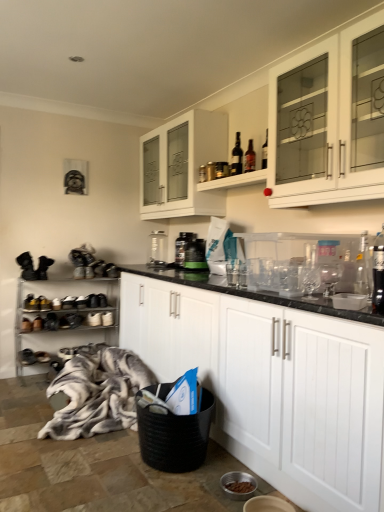
The height and width of the screenshot is (512, 384). What do you see at coordinates (62, 318) in the screenshot?
I see `metallic silver shoe rack at left, placed as the 1th shelf when sorted from left to right` at bounding box center [62, 318].

The image size is (384, 512). What do you see at coordinates (27, 357) in the screenshot?
I see `black suede shoe at lower left` at bounding box center [27, 357].

Measure the distance between black suede shoe at lower left and camera.

A distance of 3.54 meters exists between black suede shoe at lower left and camera.

In order to click on white glass cabinet at upper center, which ranks as the 1th cabinetry in top-to-bottom order in this screenshot , I will do `click(184, 164)`.

In order to face white matte cabinet at center, marked as the third cabinetry in a top-to-bottom arrangement, should I rotate leftwards or rightwards?

You should rotate right by 5.157 degrees.

What are the coordinates of `matte glass bottles at upper center, positioned as the 2th shelf in bottom-to-top order` in the screenshot? It's located at pos(234,181).

Locate an element on the screen. The height and width of the screenshot is (512, 384). dark glass bottle at upper center, the first bottle in the back-to-front sequence is located at coordinates (236, 157).

Where is `metallic silver shoe rack at left, which is the first shelf from bottom to top`? metallic silver shoe rack at left, which is the first shelf from bottom to top is located at coordinates (62, 318).

Looking at this image, from a real-world perspective, which object rests below the other?

From a 3D spatial view, white fur blanket at left is below.

Are matte glass bottles at upper center, positioned as the second shelf in left-to-right order, and white fur blanket at left beside each other?

No, matte glass bottles at upper center, positioned as the second shelf in left-to-right order, is not with white fur blanket at left.

How different are the orientations of matte glass bottles at upper center, marked as the 1th shelf in a front-to-back arrangement, and white fur blanket at left in degrees?

matte glass bottles at upper center, marked as the 1th shelf in a front-to-back arrangement, and white fur blanket at left are facing 0.0913 degrees away from each other.

Is white fur blanket at left surrounded by matte glass bottles at upper center, the first shelf in the top-to-bottom sequence?

That's incorrect, white fur blanket at left is not inside matte glass bottles at upper center, the first shelf in the top-to-bottom sequence.

Image resolution: width=384 pixels, height=512 pixels. There is a white fur blanket at left. Identify the location of the 2nd shelf above it (from a real-world perspective). (234, 181).

In the scene shown: Is white fur blanket at left closer to camera compared to matte glass bottles at upper center, positioned as the 2th shelf in bottom-to-top order?

Yes, white fur blanket at left is closer to the camera.

Does point (47, 426) appear closer or farther from the camera than point (212, 185)?

Clearly, point (47, 426) is closer to the camera than point (212, 185).

Is white fur blanket at left situated inside matte glass bottles at upper center, the first shelf in the top-to-bottom sequence, or outside?

white fur blanket at left is not enclosed by matte glass bottles at upper center, the first shelf in the top-to-bottom sequence.

Does point (181, 260) come closer to viewer compared to point (185, 257)?

No, (181, 260) is behind (185, 257).

Does black plastic bottle at center lie behind black plastic container at center?

Yes, black plastic bottle at center is further from the camera.

This screenshot has height=512, width=384. Identify the location of beverage to the left of black plastic container at center. (183, 246).

From the picture: Is white fur blanket at left inside white matte cabinet at center, marked as the third cabinetry in a top-to-bottom arrangement?

Definitely not — white fur blanket at left is not inside white matte cabinet at center, marked as the third cabinetry in a top-to-bottom arrangement.

Considering the relative sizes of white matte cabinet at center, acting as the first cabinetry starting from the bottom, and white fur blanket at left in the image provided, is white matte cabinet at center, acting as the first cabinetry starting from the bottom, wider than white fur blanket at left?

In fact, white matte cabinet at center, acting as the first cabinetry starting from the bottom, might be narrower than white fur blanket at left.

Considering the relative sizes of white matte cabinet at center, marked as the third cabinetry in a top-to-bottom arrangement, and white fur blanket at left in the image provided, is white matte cabinet at center, marked as the third cabinetry in a top-to-bottom arrangement, shorter than white fur blanket at left?

In fact, white matte cabinet at center, marked as the third cabinetry in a top-to-bottom arrangement, may be taller than white fur blanket at left.

From the image's perspective, is white matte cabinet at center, marked as the third cabinetry in a top-to-bottom arrangement, over white fur blanket at left?

Indeed, from the image's perspective, white matte cabinet at center, marked as the third cabinetry in a top-to-bottom arrangement, is shown above white fur blanket at left.

Considering the sizes of objects black woven laundry basket at lower center and white matte cabinet at center, marked as the third cabinetry in a top-to-bottom arrangement, in the image provided, who is smaller, black woven laundry basket at lower center or white matte cabinet at center, marked as the third cabinetry in a top-to-bottom arrangement,?

black woven laundry basket at lower center is smaller.

How different are the orientations of black woven laundry basket at lower center and white matte cabinet at center, marked as the third cabinetry in a top-to-bottom arrangement, in degrees?

black woven laundry basket at lower center and white matte cabinet at center, marked as the third cabinetry in a top-to-bottom arrangement, are facing 14.1 degrees away from each other.

Which is less distant, [167,426] or [141,275]?

Point [167,426] is closer to the camera than point [141,275].

Are white glass cabinet at upper center, acting as the third cabinetry starting from the bottom, and black plastic container at center making contact?

There is a gap between white glass cabinet at upper center, acting as the third cabinetry starting from the bottom, and black plastic container at center.

Is white glass cabinet at upper center, which ranks as the 1th cabinetry in top-to-bottom order, to the left or to the right of black plastic container at center in the image?

white glass cabinet at upper center, which ranks as the 1th cabinetry in top-to-bottom order, is to the left of black plastic container at center.

Is point (178, 139) closer to camera compared to point (199, 244)?

No.

From the image's perspective, would you say white glass cabinet at upper center, acting as the third cabinetry starting from the bottom, is positioned over black plastic container at center?

Yes.

Does point (101, 383) come behind point (242, 156)?

Yes, point (101, 383) is behind point (242, 156).

Which of these two, white fur blanket at left or dark glass bottle at upper center, which is counted as the first bottle, starting from the top, stands taller?

white fur blanket at left.

Image resolution: width=384 pixels, height=512 pixels. Identify the location of the 1st bottle to the right when counting from the white fur blanket at left. (236, 157).

From the image's perspective, which one is positioned lower, white fur blanket at left or dark glass bottle at upper center, the 1th bottle when ordered from left to right?

white fur blanket at left, from the image's perspective.

From the white fur blanket at left, count 1st shelfs backward and point to it. Please provide its 2D coordinates.

[(234, 181)]

From a real-world perspective, starting from the white fur blanket at left, which shelf is the 2nd one vertically above it? Please provide its 2D coordinates.

[(234, 181)]

Looking at the image, which one is located further to white fur blanket at left, black woven laundry basket at lower center or black plastic bottle at center?

black plastic bottle at center.

From the picture: Looking at the image, which one is located further to matte glass bottles at upper center, positioned as the 2th shelf in bottom-to-top order, black woven laundry basket at lower center or black plastic bottle at center?

black woven laundry basket at lower center.

Based on their spatial positions, is white fur blanket at left or black plastic container at center closer to black woven laundry basket at lower center?

The object closer to black woven laundry basket at lower center is white fur blanket at left.

Looking at the image, which one is located closer to white matte cabinet at center, marked as the third cabinetry in a top-to-bottom arrangement, clear glass bottle at upper right, arranged as the 1th bottle when ordered from the bottom, or black suede shoe at lower left?

clear glass bottle at upper right, arranged as the 1th bottle when ordered from the bottom, is positioned closer to the anchor white matte cabinet at center, marked as the third cabinetry in a top-to-bottom arrangement.

Based on their spatial positions, is white glass cabinet at upper center, acting as the third cabinetry starting from the bottom, or white fur blanket at left further from dark glass bottle at upper center, the first bottle in the back-to-front sequence?

white fur blanket at left is further to dark glass bottle at upper center, the first bottle in the back-to-front sequence.

Looking at the image, which one is located further to clear glass bottle at upper right, which ranks as the second bottle in top-to-bottom order, dark glass bottle at upper center, the 2th bottle positioned from the right, or black woven laundry basket at lower center?

Based on the image, black woven laundry basket at lower center appears to be further to clear glass bottle at upper right, which ranks as the second bottle in top-to-bottom order.

Looking at the image, which one is located further to clear glass bottle at upper right, acting as the second bottle starting from the left, white matte cabinet at center, marked as the third cabinetry in a top-to-bottom arrangement, or matte glass bottles at upper center, which ranks as the second shelf in back-to-front order?

Based on the image, matte glass bottles at upper center, which ranks as the second shelf in back-to-front order, appears to be further to clear glass bottle at upper right, acting as the second bottle starting from the left.

Estimate the real-world distances between objects in this image. Which object is closer to clear glass bottle at upper right, the second bottle viewed from the back, white matte cabinet at center, marked as the third cabinetry in a top-to-bottom arrangement, or black plastic bottle at center?

Among the two, white matte cabinet at center, marked as the third cabinetry in a top-to-bottom arrangement, is located nearer to clear glass bottle at upper right, the second bottle viewed from the back.

I want to click on blanket located between black woven laundry basket at lower center and black suede shoe at lower left in the depth direction, so click(x=97, y=393).

Find the location of `bottle between white glass cabinet at upper right, the second cabinetry positioned from the top, and white matte cabinet at center, acting as the first cabinetry starting from the bottom, in the up-down direction`. bottle between white glass cabinet at upper right, the second cabinetry positioned from the top, and white matte cabinet at center, acting as the first cabinetry starting from the bottom, in the up-down direction is located at coordinates (363, 267).

Where is `bottle between clear glass bottle at upper right, the 1th bottle in the front-to-back sequence, and white glass cabinet at upper center, acting as the third cabinetry starting from the bottom, along the z-axis`? This screenshot has width=384, height=512. bottle between clear glass bottle at upper right, the 1th bottle in the front-to-back sequence, and white glass cabinet at upper center, acting as the third cabinetry starting from the bottom, along the z-axis is located at coordinates (236, 157).

I want to click on laundry basket between white glass cabinet at upper center, which ranks as the 1th cabinetry in top-to-bottom order, and black suede shoe at lower left in the up-down direction, so click(x=174, y=435).